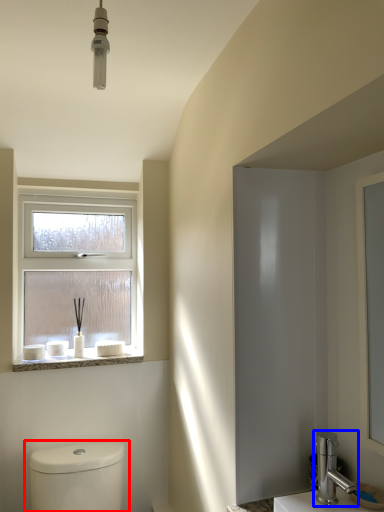
Question: Which of the following is the closest to the observer, toilet (highlighted by a red box) or tap (highlighted by a blue box)?

Choices:
 (A) toilet
 (B) tap

Answer: (B)